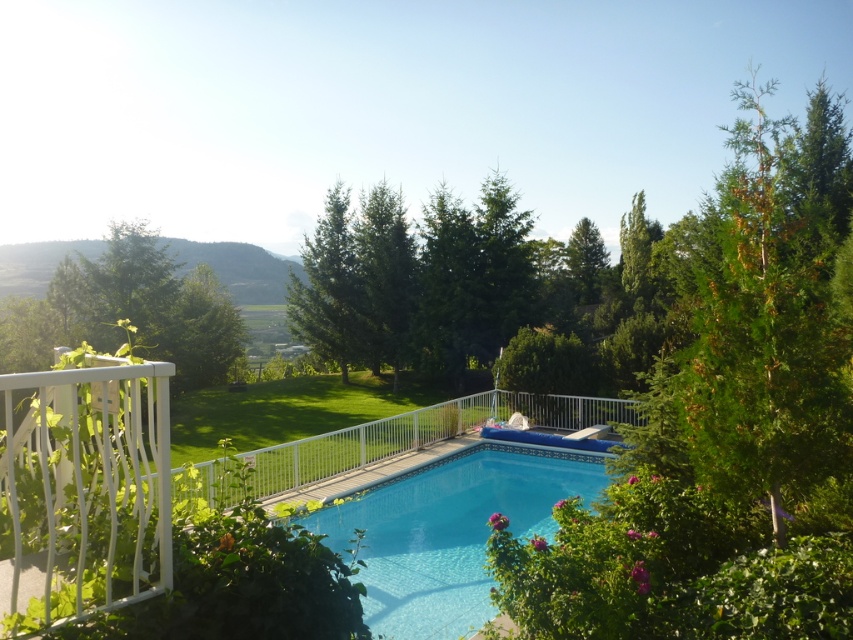
Question: Does white metal railing at center appear under white wrought iron railing at left?

Choices:
 (A) yes
 (B) no

Answer: (A)

Question: Is green leafy tree at upper right bigger than clear glass pool at center?

Choices:
 (A) no
 (B) yes

Answer: (B)

Question: Considering the real-world distances, which object is closest to the green leafy tree at left?

Choices:
 (A) white metal railing at center
 (B) white wrought iron railing at left
 (C) clear glass pool at center

Answer: (A)

Question: Among these objects, which one is nearest to the camera?

Choices:
 (A) green leafy tree at upper right
 (B) white wrought iron railing at left
 (C) green leafy tree at left
 (D) white metal railing at center

Answer: (D)

Question: Does green leafy tree at upper right appear over white metal railing at center?

Choices:
 (A) no
 (B) yes

Answer: (B)

Question: Which point is farther to the camera?

Choices:
 (A) (552, 524)
 (B) (10, 627)
 (C) (120, 259)

Answer: (C)